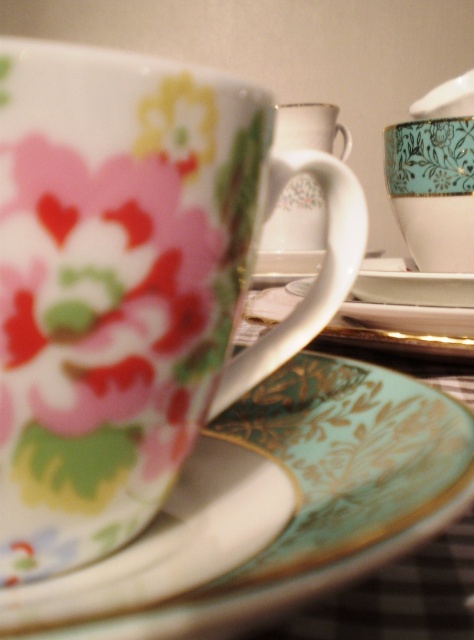
You are holding a map of the image where coordinates are given as fractions between 0 and 1. You want to place a sticker exactly at point (131, 284). According to the scene description, which object should the sticker be placed on?

The point (131, 284) is on the floral porcelain mug at upper center, so the sticker should be placed there.